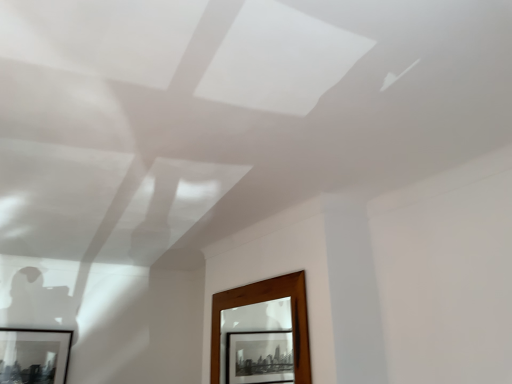
Question: Should I look upward or downward to see black matte picture frame at lower left?

Choices:
 (A) up
 (B) down

Answer: (B)

Question: Does black matte picture frame at lower left have a lesser height compared to wooden frame at lower center?

Choices:
 (A) yes
 (B) no

Answer: (A)

Question: From the image's perspective, is black matte picture frame at lower left under wooden frame at lower center?

Choices:
 (A) yes
 (B) no

Answer: (A)

Question: Is wooden frame at lower center inside black matte picture frame at lower left?

Choices:
 (A) no
 (B) yes

Answer: (A)

Question: From the image's perspective, is black matte picture frame at lower left on wooden frame at lower center?

Choices:
 (A) no
 (B) yes

Answer: (A)

Question: Considering the relative sizes of black matte picture frame at lower left and wooden frame at lower center in the image provided, is black matte picture frame at lower left taller than wooden frame at lower center?

Choices:
 (A) no
 (B) yes

Answer: (A)

Question: Would you say black matte picture frame at lower left is outside wooden frame at lower center?

Choices:
 (A) no
 (B) yes

Answer: (B)

Question: Does wooden frame at lower center come in front of black matte picture frame at lower left?

Choices:
 (A) yes
 (B) no

Answer: (A)

Question: Does wooden frame at lower center appear on the right side of black matte picture frame at lower left?

Choices:
 (A) yes
 (B) no

Answer: (A)

Question: Does wooden frame at lower center appear on the left side of black matte picture frame at lower left?

Choices:
 (A) no
 (B) yes

Answer: (A)

Question: Does wooden frame at lower center have a larger size compared to black matte picture frame at lower left?

Choices:
 (A) no
 (B) yes

Answer: (B)

Question: Is wooden frame at lower center facing away from black matte picture frame at lower left?

Choices:
 (A) yes
 (B) no

Answer: (B)

Question: Does wooden frame at lower center come behind black matte picture frame at lower left?

Choices:
 (A) yes
 (B) no

Answer: (B)

Question: In the image, is wooden frame at lower center on the left side or the right side of black matte picture frame at lower left?

Choices:
 (A) left
 (B) right

Answer: (B)